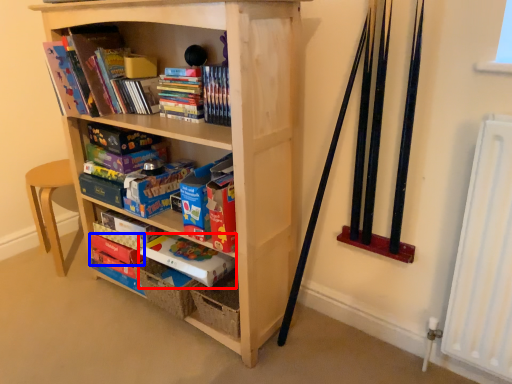
Question: Which point is closer to the camera, paperback book (highlighted by a red box) or paperback book (highlighted by a blue box)?

Choices:
 (A) paperback book
 (B) paperback book

Answer: (A)